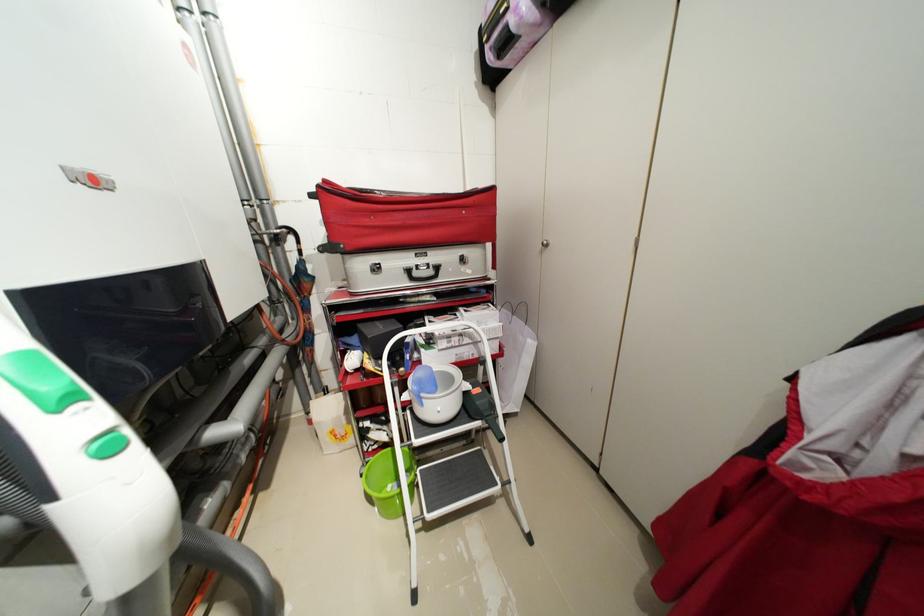
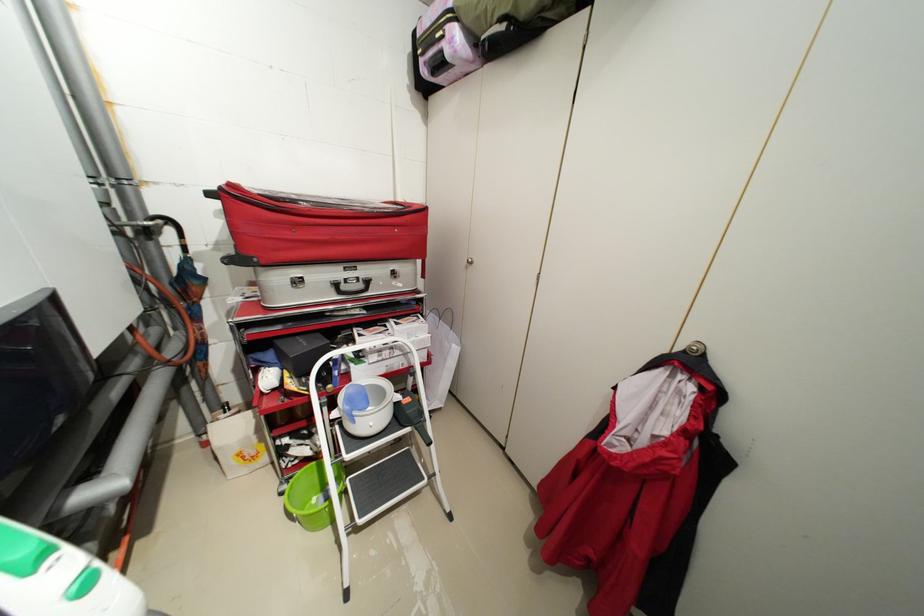
Question: Based on the continuous images, in which direction is the camera rotating? Reply with the corresponding letter.

Choices:
 (A) Left
 (B) Right
 (C) Up
 (D) Down

Answer: (B)